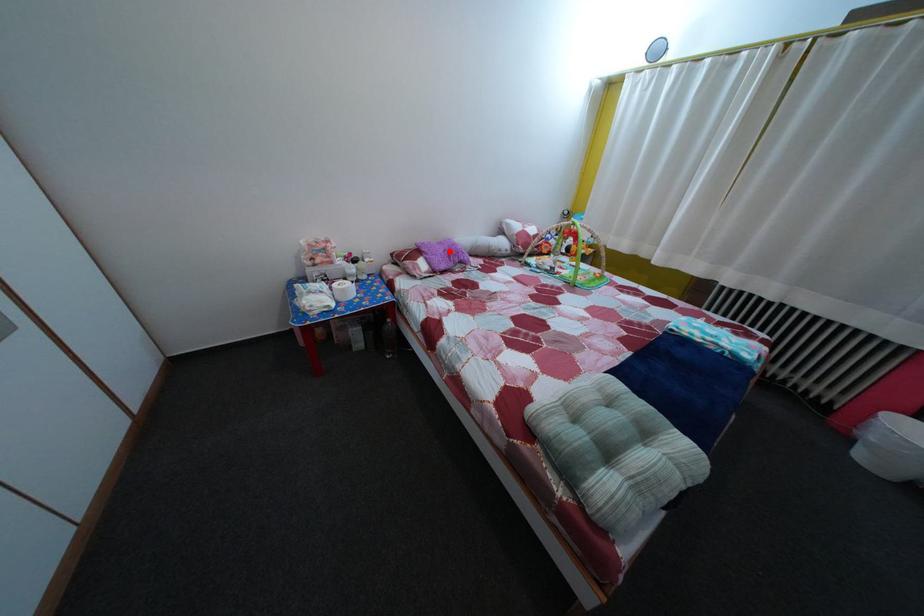
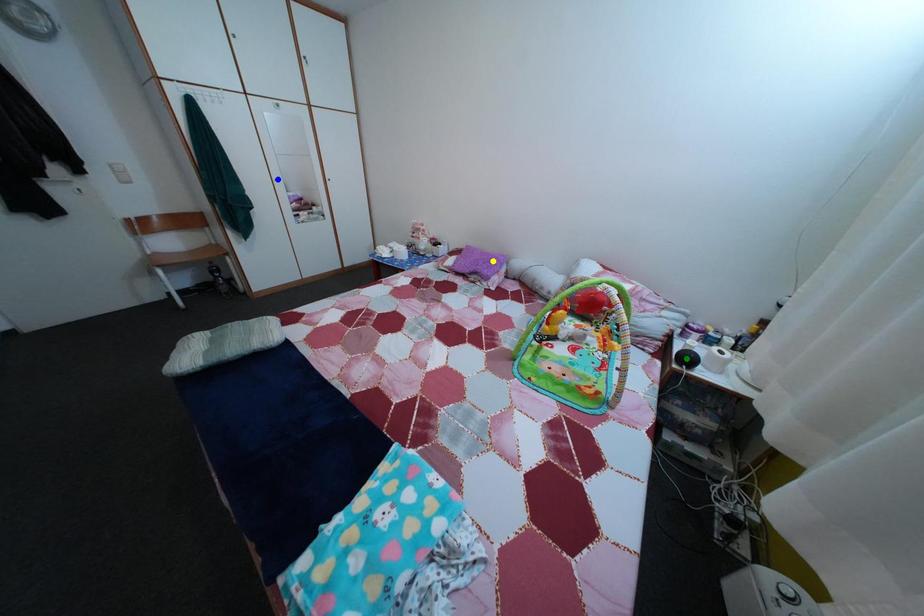
Question: I am providing you with two images of the same scene from different viewpoints. A red point is marked on the first image. You are given multiple points on the second image. In image 2, which mark is for the same physical point as the one in image 1?

Choices:
 (A) green point
 (B) blue point
 (C) yellow point

Answer: (C)